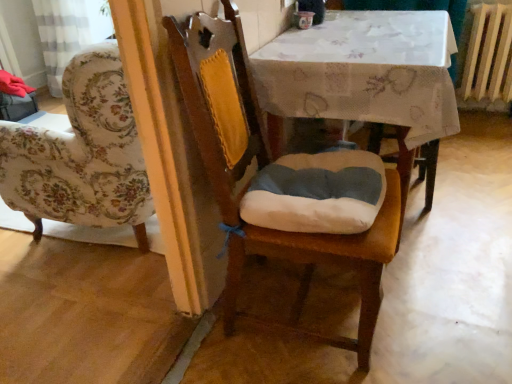
Question: From the image's perspective, is wooden radiator at right above white fabric table at center?

Choices:
 (A) no
 (B) yes

Answer: (B)

Question: Is wooden radiator at right to the left of white fabric table at center from the viewer's perspective?

Choices:
 (A) no
 (B) yes

Answer: (A)

Question: Is the position of wooden radiator at right more distant than that of white fabric table at center?

Choices:
 (A) no
 (B) yes

Answer: (B)

Question: Is wooden radiator at right aimed at white fabric table at center?

Choices:
 (A) yes
 (B) no

Answer: (B)

Question: Can you confirm if wooden radiator at right is shorter than white fabric table at center?

Choices:
 (A) no
 (B) yes

Answer: (B)

Question: Considering the positions of white fabric table at center and wooden chair at center in the image, is white fabric table at center taller or shorter than wooden chair at center?

Choices:
 (A) tall
 (B) short

Answer: (B)

Question: From the image's perspective, is white fabric table at center located above or below wooden chair at center?

Choices:
 (A) below
 (B) above

Answer: (B)

Question: Relative to wooden chair at center, is white fabric table at center in front or behind?

Choices:
 (A) front
 (B) behind

Answer: (B)

Question: From a real-world perspective, is white fabric table at center physically located above or below wooden chair at center?

Choices:
 (A) above
 (B) below

Answer: (B)

Question: Looking at the image, does white fabric table at center seem bigger or smaller compared to wooden radiator at right?

Choices:
 (A) big
 (B) small

Answer: (A)

Question: Do you think white fabric table at center is within wooden radiator at right, or outside of it?

Choices:
 (A) outside
 (B) inside

Answer: (A)

Question: From a real-world perspective, is white fabric table at center above or below wooden radiator at right?

Choices:
 (A) below
 (B) above

Answer: (A)

Question: Relative to wooden radiator at right, is white fabric table at center in front or behind?

Choices:
 (A) front
 (B) behind

Answer: (A)

Question: Is wooden radiator at right bigger or smaller than wooden chair at center?

Choices:
 (A) big
 (B) small

Answer: (B)

Question: Looking at their shapes, would you say wooden radiator at right is wider or thinner than wooden chair at center?

Choices:
 (A) thin
 (B) wide

Answer: (A)